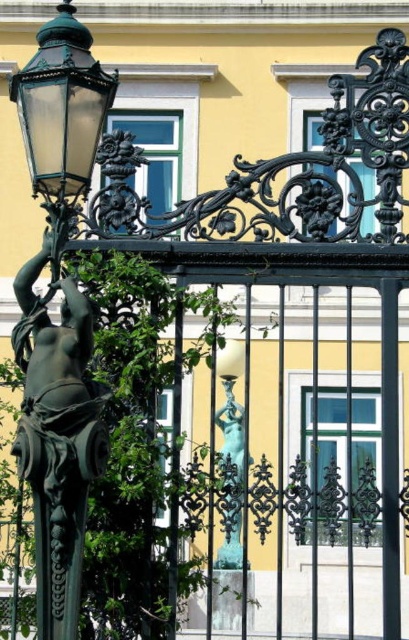
Between green glass streetlight at left and shiny bronze statue at center, which one appears on the right side from the viewer's perspective?

shiny bronze statue at center is more to the right.

Is point (71, 58) positioned after point (224, 422)?

No, it is in front of (224, 422).

At what (x,y) coordinates should I click in order to perform the action: click on green glass streetlight at left. Please return your answer as a coordinate pair (x, y). Image resolution: width=409 pixels, height=640 pixels. Looking at the image, I should click on (62, 118).

Between bronze/golden statue at left and shiny bronze statue at center, which one appears on the right side from the viewer's perspective?

From the viewer's perspective, shiny bronze statue at center appears more on the right side.

Is bronze/golden statue at left positioned at the back of shiny bronze statue at center?

No, bronze/golden statue at left is closer to the viewer.

Which is in front, point (17, 353) or point (242, 456)?

Point (17, 353)

Find the location of `bronze/golden statue at left`. bronze/golden statue at left is located at coordinates (56, 436).

Which is behind, point (49, 340) or point (110, 100)?

The point (110, 100) is behind.

This screenshot has height=640, width=409. In order to click on bronze/golden statue at left in this screenshot , I will do click(56, 436).

The image size is (409, 640). In order to click on bronze/golden statue at left in this screenshot , I will do `click(56, 436)`.